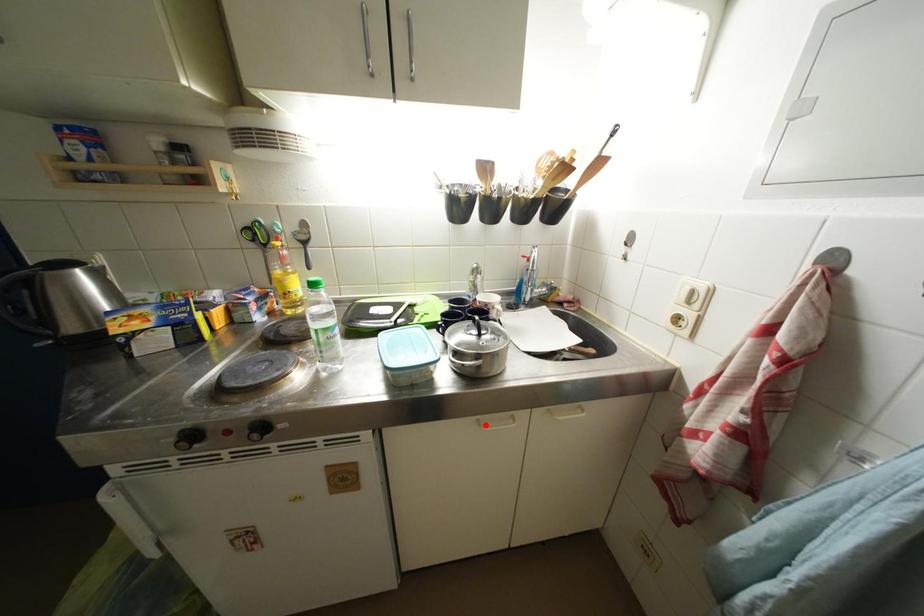
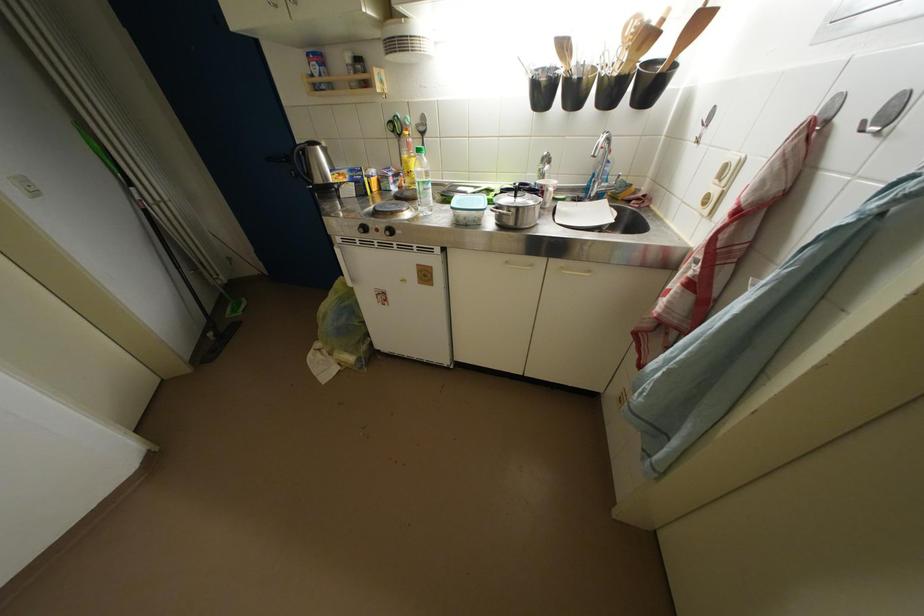
Question: I am providing you with two images of the same scene from different viewpoints. A red point is marked on the first image. Can you still see the location of the red point in image 2?

Choices:
 (A) Yes
 (B) No

Answer: (A)